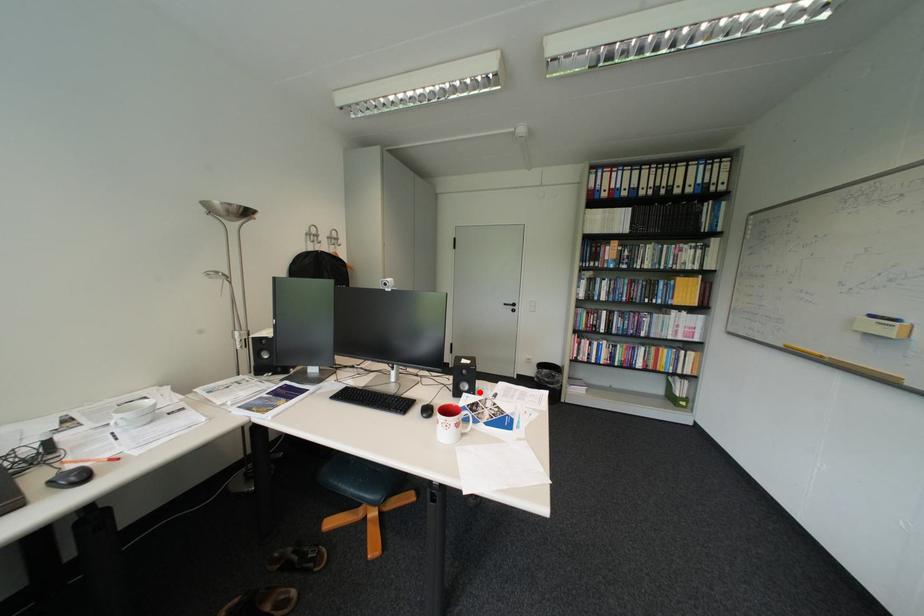
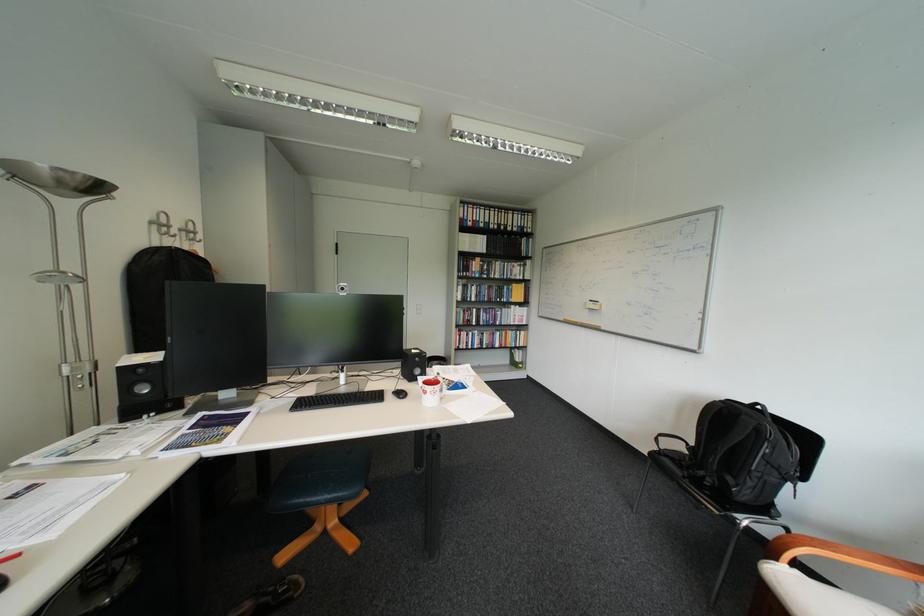
In the second image, find the point that corresponds to the highlighted location in the first image.

(432, 376)